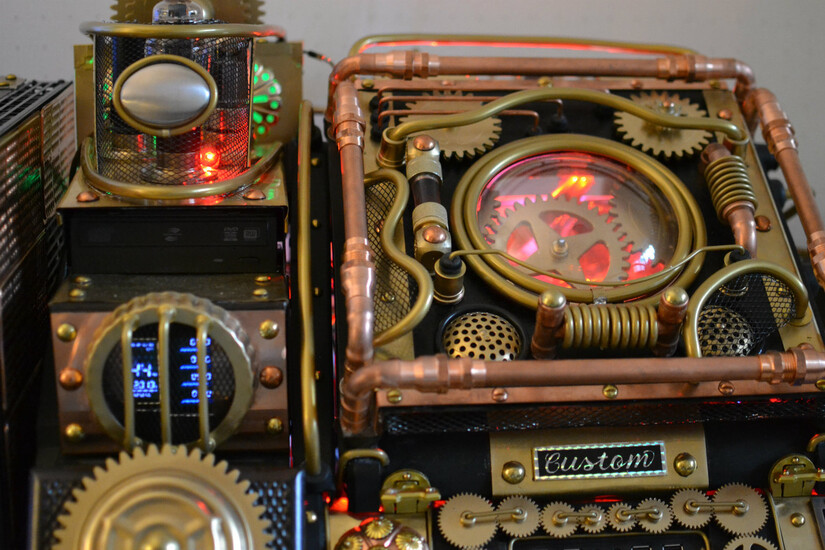
The width and height of the screenshot is (825, 550). Identify the location of display. (144, 378), (186, 383).